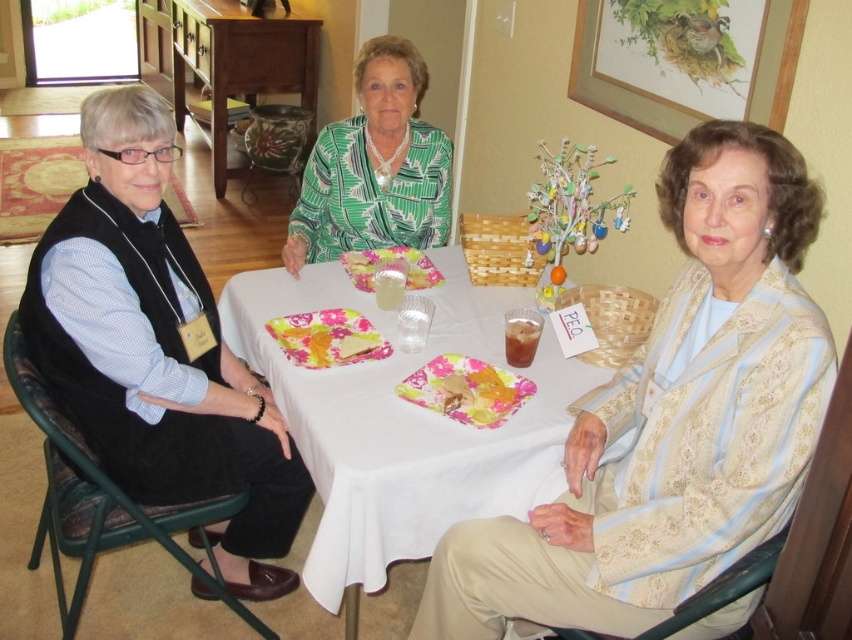
Question: Is light beige textured jacket at lower right further to the viewer compared to translucent plastic cup at center?

Choices:
 (A) yes
 (B) no

Answer: (B)

Question: Which of the following is the farthest from the observer?

Choices:
 (A) wooden picture frame at upper right
 (B) floral paper plate with food at center

Answer: (A)

Question: Which point is closer to the camera?

Choices:
 (A) matte black vest at left
 (B) translucent plastic cup at center
 (C) floral paper plate with food at center

Answer: (A)

Question: Can you confirm if floral paper plate with food at center is positioned below translucent plastic cup at center?

Choices:
 (A) yes
 (B) no

Answer: (A)

Question: Estimate the real-world distances between objects in this image. Which object is farther from the floral paper plate with food at center?

Choices:
 (A) white cloth at center
 (B) green printed blouse at center
 (C) matte black vest at left

Answer: (B)

Question: Does light beige textured jacket at lower right appear on the left side of wooden picture frame at upper right?

Choices:
 (A) yes
 (B) no

Answer: (A)